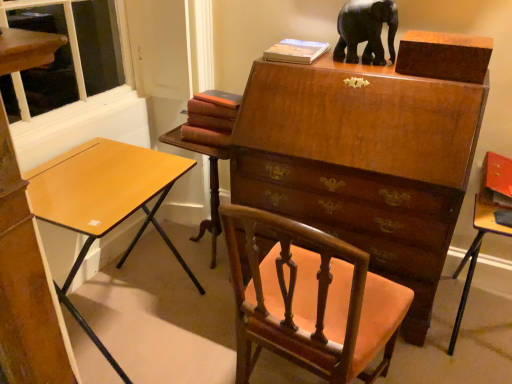
This screenshot has height=384, width=512. I want to click on vacant area on top of light brown wood desk at left (from a real-world perspective), so click(x=105, y=179).